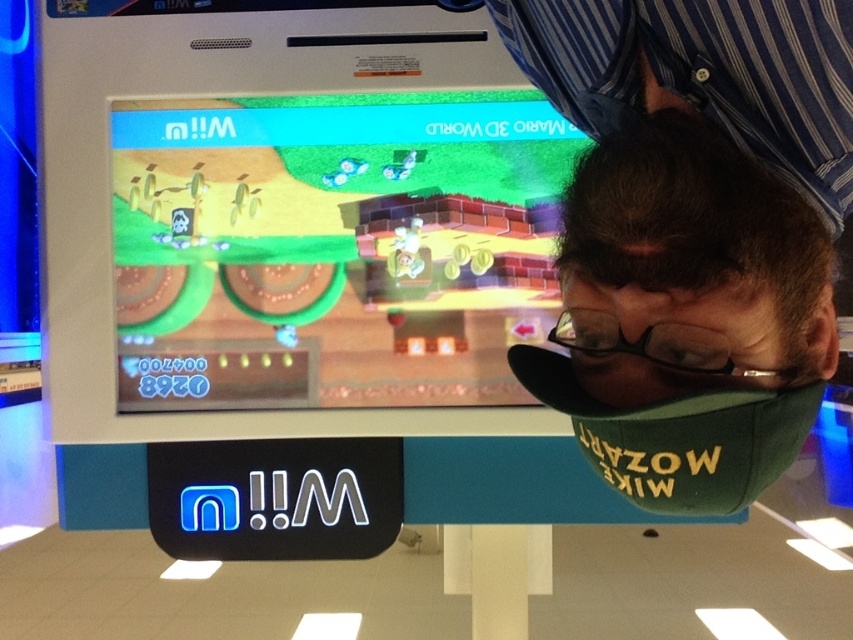
Does green fabric cap at center have a lesser height compared to black plastic glasses at center?

In fact, green fabric cap at center may be taller than black plastic glasses at center.

Is green fabric cap at center further to the viewer compared to black plastic glasses at center?

No, green fabric cap at center is in front of black plastic glasses at center.

Identify the location of green fabric cap at center. This screenshot has height=640, width=853. (693, 225).

The width and height of the screenshot is (853, 640). Identify the location of green fabric cap at center. (693, 225).

Is point (444, 307) less distant than point (693, 369)?

No, (444, 307) is behind (693, 369).

Which is below, matte green platform at center or black plastic glasses at center?

black plastic glasses at center is lower down.

Which is behind, point (471, 97) or point (704, 356)?

The point (471, 97) is behind.

You are a GUI agent. You are given a task and a screenshot of the screen. Output one action in this format:
    pyautogui.click(x=<x>, y=<y>)
    Task: Click on the matte green platform at center
    
    Given the screenshot: What is the action you would take?
    pyautogui.click(x=334, y=248)

Measure the distance between point (605, 275) and camera.

62.06 centimeters

Is green fabric cap at center taller than matte green platform at center?

In fact, green fabric cap at center may be shorter than matte green platform at center.

Who is more forward, (775, 461) or (305, 144)?

Point (775, 461) is in front.

Identify the location of green fabric cap at center. The image size is (853, 640). (693, 225).